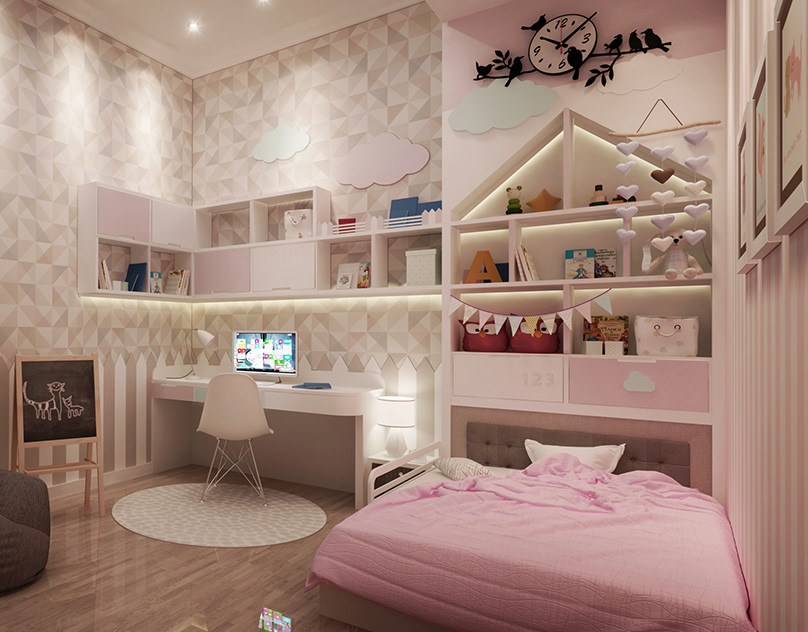
Locate an element on the screen. The height and width of the screenshot is (632, 808). white desk lamp is located at coordinates (200, 339).